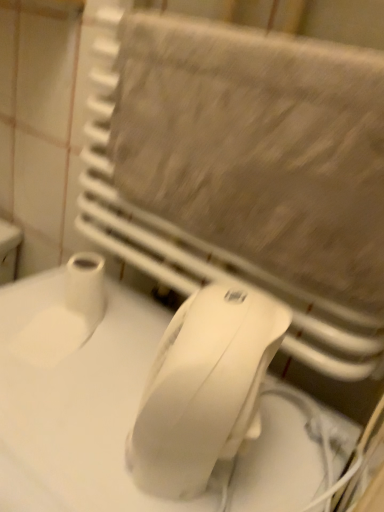
This screenshot has width=384, height=512. Identify the location of vacant area that is situated to the right of white matte toilet paper at lower left. (128, 327).